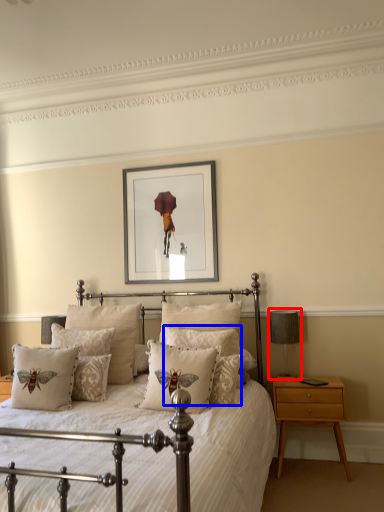
Question: Which point is further to the camera, table lamp (highlighted by a red box) or pillow (highlighted by a blue box)?

Choices:
 (A) table lamp
 (B) pillow

Answer: (A)